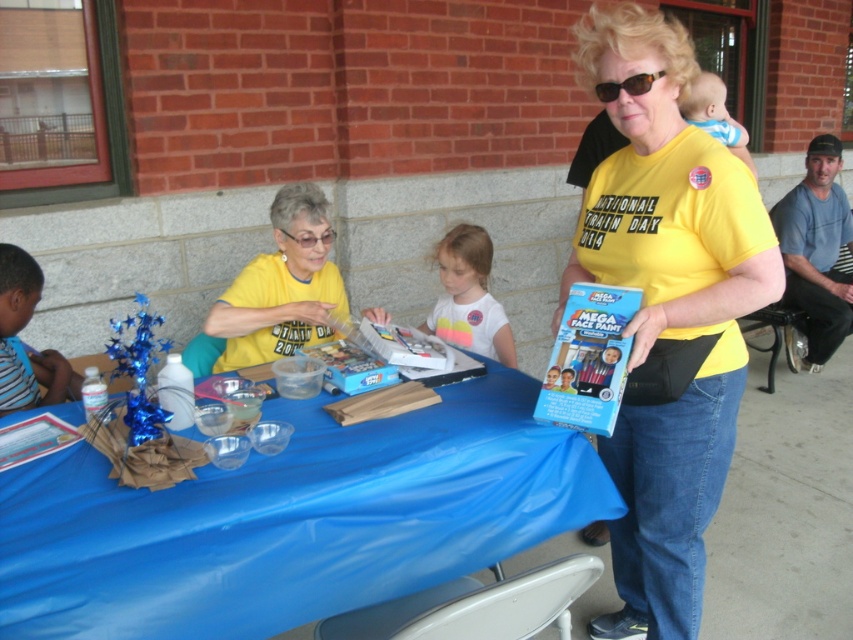
Is yellow fabric shirt at center to the left of tortoiseshell plastic goggles at upper center from the viewer's perspective?

In fact, yellow fabric shirt at center is to the right of tortoiseshell plastic goggles at upper center.

In the scene shown: Who is more forward, [722,348] or [653,77]?

Positioned in front is point [653,77].

Identify the location of yellow fabric shirt at center. (666, 312).

Can you confirm if white cotton shirt at center is shorter than tortoiseshell plastic goggles at upper center?

No.

Is point (416, 326) more distant than point (650, 84)?

Yes, it is behind point (650, 84).

Identify the location of white cotton shirt at center. Image resolution: width=853 pixels, height=640 pixels. tap(469, 296).

Does blue plastic table at center come in front of tortoiseshell plastic goggles at upper center?

Yes.

What do you see at coordinates (293, 518) in the screenshot?
I see `blue plastic table at center` at bounding box center [293, 518].

What do you see at coordinates (293, 518) in the screenshot?
I see `blue plastic table at center` at bounding box center [293, 518].

Find the location of a particular element. The image size is (853, 640). blue plastic table at center is located at coordinates (293, 518).